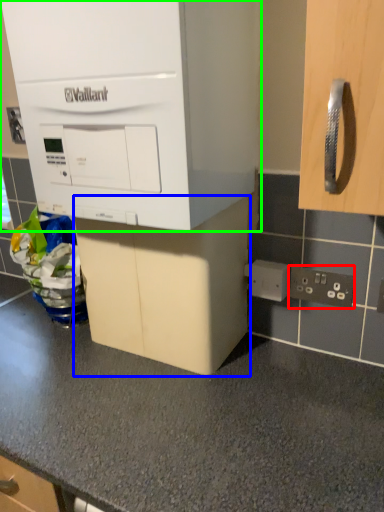
Question: Considering the real-world distances, which object is farthest from electric outlet (highlighted by a red box)? cabinetry (highlighted by a blue box) or cabinetry (highlighted by a green box)?

Choices:
 (A) cabinetry
 (B) cabinetry

Answer: (B)